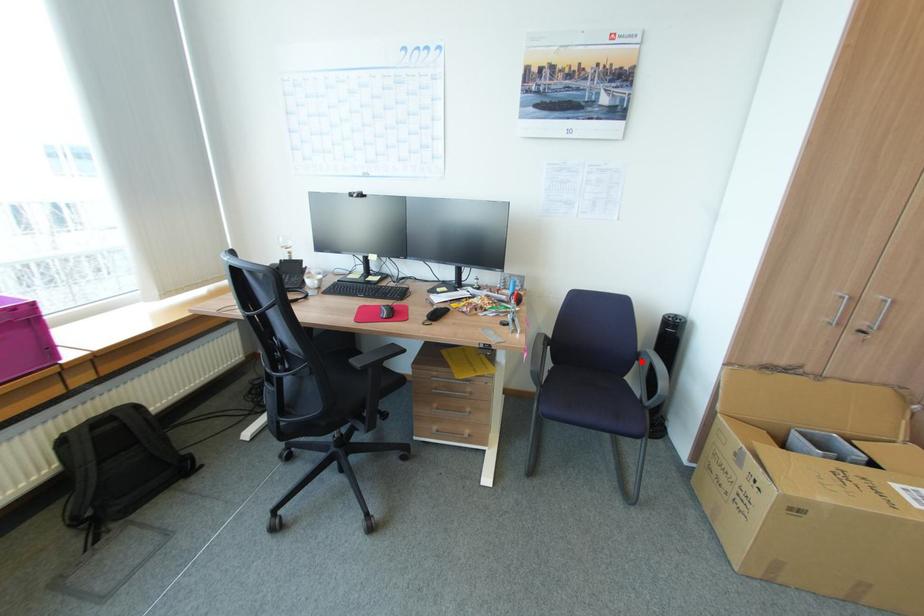
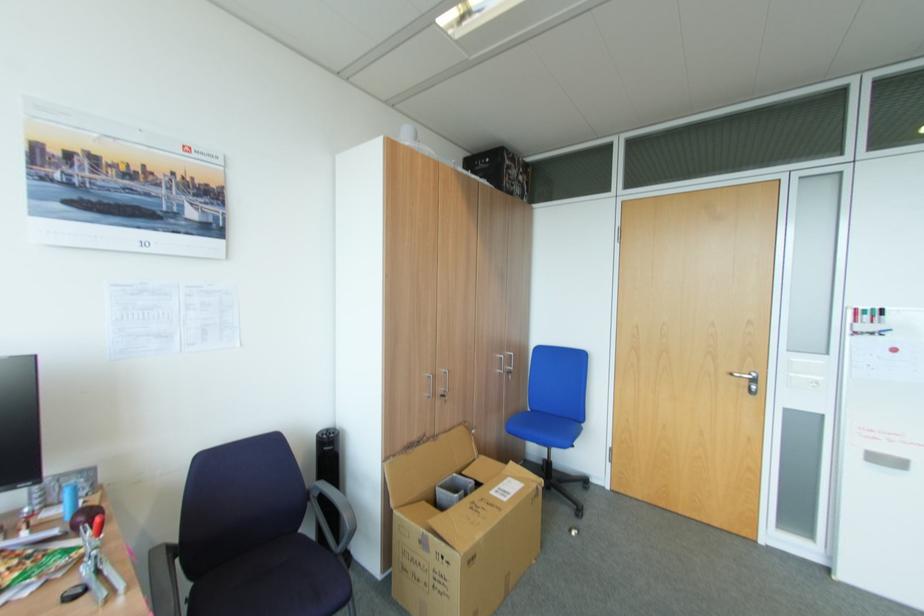
In the second image, find the point that corresponds to the highlighted location in the first image.

(313, 501)